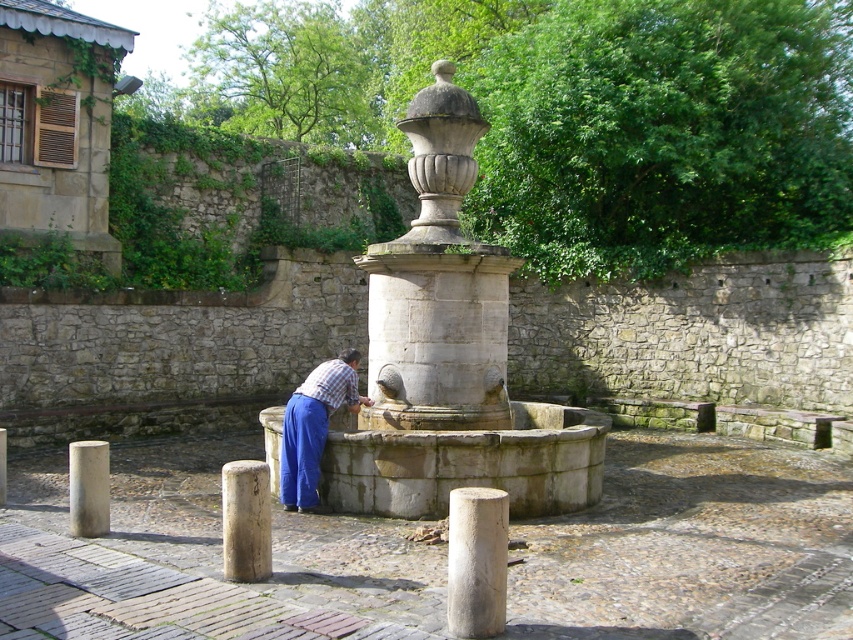
Question: Among these points, which one is nearest to the camera?

Choices:
 (A) (495, 598)
 (B) (91, 483)
 (C) (4, 492)

Answer: (A)

Question: Can you confirm if white stone pillar at center is thinner than smooth gray stone pillar at center?

Choices:
 (A) no
 (B) yes

Answer: (A)

Question: Considering the relative positions of white stone pillar at center and smooth gray stone pillar at center in the image provided, where is white stone pillar at center located with respect to smooth gray stone pillar at center?

Choices:
 (A) above
 (B) below

Answer: (B)

Question: Which object is closer to the camera taking this photo?

Choices:
 (A) smooth gray post at lower left
 (B) stone fountain at center
 (C) smooth gray stone pillar at center

Answer: (A)

Question: Does smooth gray post at lower left have a lesser width compared to smooth gray stone pillar at center?

Choices:
 (A) no
 (B) yes

Answer: (A)

Question: Which point is closer to the camera taking this photo?

Choices:
 (A) (489, 593)
 (B) (236, 573)
 (C) (438, 497)
 (D) (0, 502)

Answer: (A)